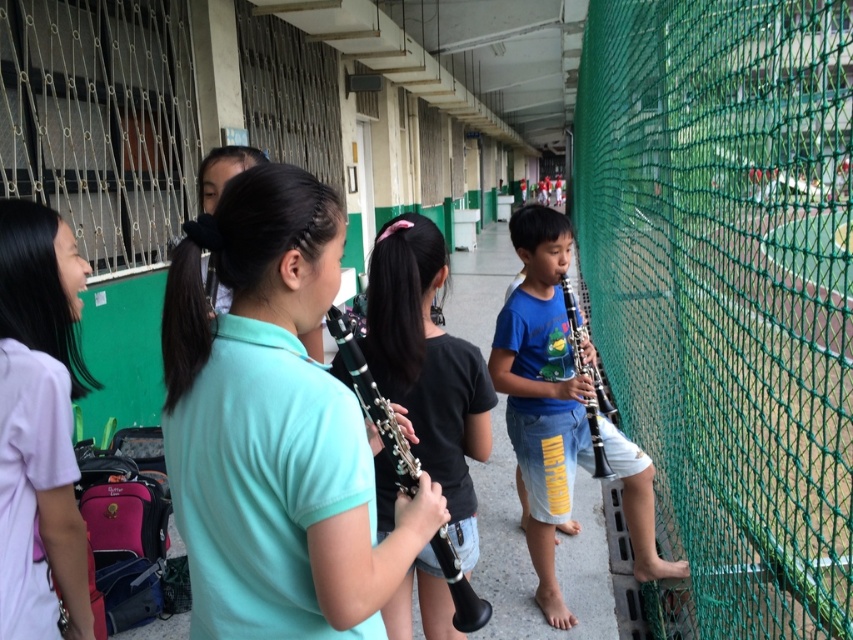
Who is more distant from viewer, (225, 410) or (531, 540)?

The point (531, 540) is more distant.

Does teal matte clarinet at center have a greater height compared to blue matte hautboy at right?

Incorrect, teal matte clarinet at center's height is not larger of blue matte hautboy at right's.

This screenshot has width=853, height=640. Describe the element at coordinates (274, 428) in the screenshot. I see `teal matte clarinet at center` at that location.

Identify the location of teal matte clarinet at center. (274, 428).

Is blue matte hautboy at right in front of blue matte clarinet at center?

Yes, it is.

What do you see at coordinates (543, 392) in the screenshot? I see `blue matte hautboy at right` at bounding box center [543, 392].

Who is more distant from viewer, (554, 534) or (566, 314)?

The point (554, 534) is more distant.

Where is `blue matte hautboy at right`? Image resolution: width=853 pixels, height=640 pixels. blue matte hautboy at right is located at coordinates click(543, 392).

Does light purple cotton shirt at left appear over black plastic clarinet at center?

Indeed, light purple cotton shirt at left is positioned over black plastic clarinet at center.

This screenshot has height=640, width=853. I want to click on light purple cotton shirt at left, so click(41, 285).

The width and height of the screenshot is (853, 640). Identify the location of light purple cotton shirt at left. (41, 285).